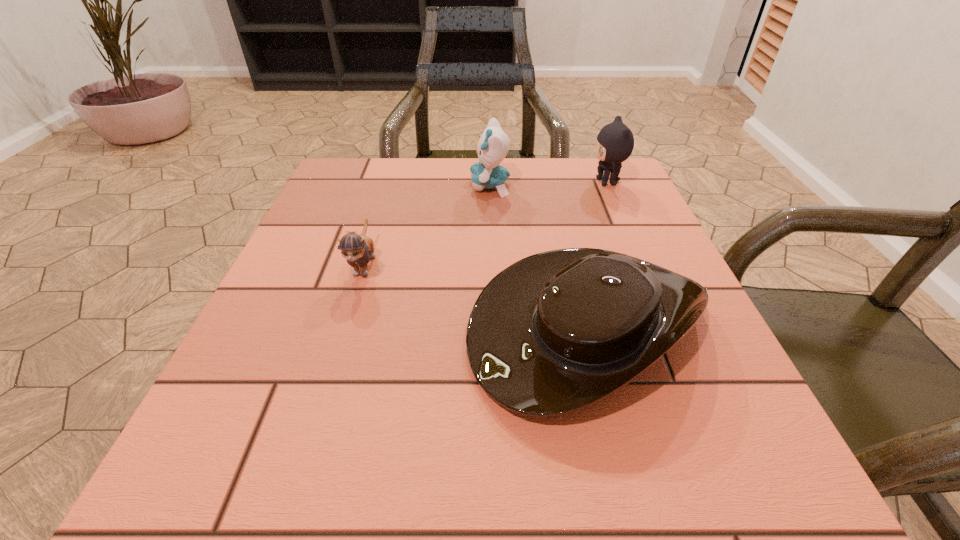
I want to click on vacant space that satisfies the following two spatial constraints: 1. on the front-facing side of the leftmost object; 2. on the right side of the cowboy hat, so click(346, 324).

Find the location of a particular element. Image resolution: width=960 pixels, height=540 pixels. vacant area that satisfies the following two spatial constraints: 1. on the face of the second kitten from left to right; 2. on the right side of the cowboy hat is located at coordinates (494, 324).

Find the location of a particular element. This screenshot has width=960, height=540. vacant region that satisfies the following two spatial constraints: 1. on the front-facing side of the rightmost kitten; 2. on the front-facing side of the nearest kitten is located at coordinates (642, 264).

I want to click on free space that satisfies the following two spatial constraints: 1. on the face of the second kitten from right to left; 2. on the front-facing side of the shortest kitten, so click(492, 264).

I want to click on vacant space that satisfies the following two spatial constraints: 1. on the front-facing side of the rightmost kitten; 2. on the front-facing side of the leftmost object, so click(642, 264).

Image resolution: width=960 pixels, height=540 pixels. Find the location of `vacant area that satisfies the following two spatial constraints: 1. on the face of the second kitten from right to left; 2. on the front-facing side of the shortest kitten`. vacant area that satisfies the following two spatial constraints: 1. on the face of the second kitten from right to left; 2. on the front-facing side of the shortest kitten is located at coordinates (492, 264).

Find the location of `free point that satisfies the following two spatial constraints: 1. on the front-facing side of the cowboy hat; 2. on the right side of the nearest kitten`. free point that satisfies the following two spatial constraints: 1. on the front-facing side of the cowboy hat; 2. on the right side of the nearest kitten is located at coordinates (346, 324).

At what (x,y) coordinates should I click in order to perform the action: click on vacant space that satisfies the following two spatial constraints: 1. on the back side of the cowboy hat; 2. on the face of the second kitten from right to left. Please return your answer as a coordinate pair (x, y). Looking at the image, I should click on (552, 186).